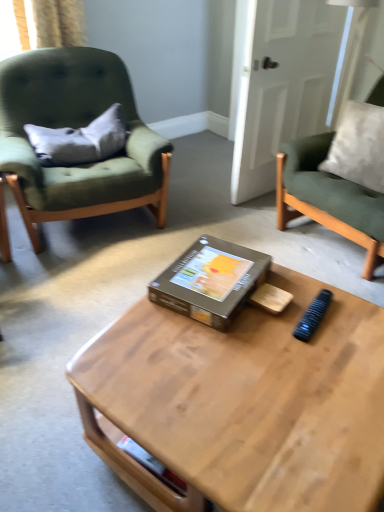
Question: Is black plastic remote control at center far from green fabric chair at left, the second chair from the right?

Choices:
 (A) yes
 (B) no

Answer: (A)

Question: Is black plastic remote control at center outside of green fabric chair at left, the second chair from the right?

Choices:
 (A) no
 (B) yes

Answer: (B)

Question: From the image's perspective, is black plastic remote control at center under green fabric chair at left, arranged as the 1th chair when viewed from the left?

Choices:
 (A) yes
 (B) no

Answer: (A)

Question: Does black plastic remote control at center come in front of green fabric chair at left, arranged as the 1th chair when viewed from the left?

Choices:
 (A) yes
 (B) no

Answer: (A)

Question: Is black plastic remote control at center bigger than green fabric chair at left, arranged as the 1th chair when viewed from the left?

Choices:
 (A) yes
 (B) no

Answer: (B)

Question: Is black plastic remote control at center facing away from green fabric chair at left, arranged as the 1th chair when viewed from the left?

Choices:
 (A) yes
 (B) no

Answer: (B)

Question: Is wooden coffee table at center positioned in front of black plastic remote control at center?

Choices:
 (A) yes
 (B) no

Answer: (A)

Question: Is wooden coffee table at center further to camera compared to black plastic remote control at center?

Choices:
 (A) no
 (B) yes

Answer: (A)

Question: Is wooden coffee table at center beside black plastic remote control at center?

Choices:
 (A) yes
 (B) no

Answer: (B)

Question: Is wooden coffee table at center far from black plastic remote control at center?

Choices:
 (A) yes
 (B) no

Answer: (B)

Question: Is wooden coffee table at center to the left of black plastic remote control at center from the viewer's perspective?

Choices:
 (A) no
 (B) yes

Answer: (B)

Question: Is wooden coffee table at center oriented towards black plastic remote control at center?

Choices:
 (A) no
 (B) yes

Answer: (A)

Question: Is gray fabric pillow at left next to green fabric chair at left, arranged as the 1th chair when viewed from the left?

Choices:
 (A) yes
 (B) no

Answer: (B)